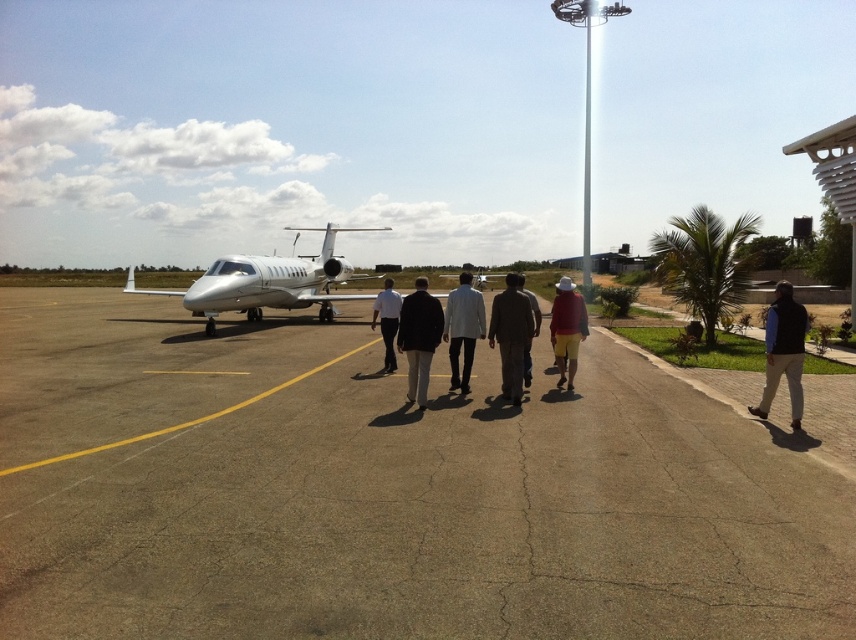
Which is in front, point (783, 282) or point (522, 298)?

Point (522, 298)

Does dark blue vest at center have a lesser height compared to dark brown leather jacket at center?

Correct, dark blue vest at center is not as tall as dark brown leather jacket at center.

Is point (795, 333) positioned before point (504, 362)?

Yes, it is in front of point (504, 362).

Find the location of a particular element. This screenshot has height=640, width=856. dark blue vest at center is located at coordinates (783, 352).

Measure the distance between black leather jacket at center and dark brown leather jacket at center.

4.36 feet

Measure the distance between black leather jacket at center and dark brown leather jacket at center.

black leather jacket at center and dark brown leather jacket at center are 4.36 feet apart from each other.

Which is behind, point (414, 378) or point (516, 321)?

Positioned behind is point (516, 321).

This screenshot has height=640, width=856. I want to click on black leather jacket at center, so click(419, 339).

Does point (783, 323) come in front of point (528, 348)?

Yes, it is in front of point (528, 348).

Is the position of dark blue vest at center more distant than that of khaki pants at center?

No, dark blue vest at center is closer to the viewer.

The height and width of the screenshot is (640, 856). I want to click on dark blue vest at center, so click(x=783, y=352).